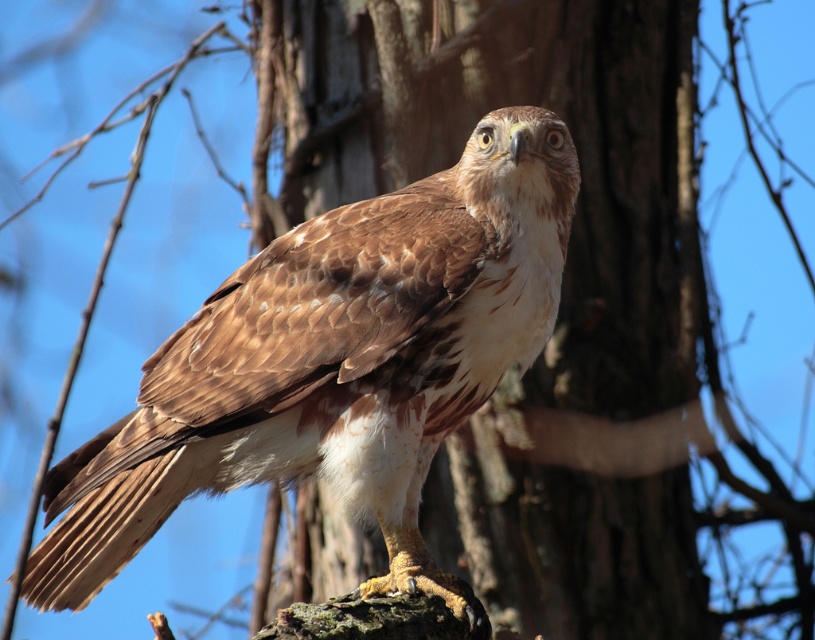
You are a birdwatcher observing a Red Tailed Hawk in a forest. You see the brown rough bark at center and the brown feathered eagle at center. Which object is located higher in the image?

The brown rough bark at center is located higher than the brown feathered eagle at center in the image.

You are a photographer trying to capture the brown feathered eagle at center and the brown rough bark at center in a single frame. Which object should you adjust your camera focus on to ensure the eagle is the main subject?

The brown rough bark at center is positioned on the right side of brown feathered eagle at center. To ensure the eagle is the main subject, focus on the brown feathered eagle at center since it is the primary subject and the bark is part of the background.

You are a photographer trying to capture a closeup of the brown rough bark at center and the brown feathered eagle at center in the same frame. Considering the distance between them, can you fit both subjects into your camera viewfinder without moving the camera?

The brown rough bark at center and brown feathered eagle at center are 1.62 meters apart from each other. If your camera viewfinder can accommodate a distance of at least 1.62 meters between the two subjects, then yes, you can fit both into the frame without moving the camera.